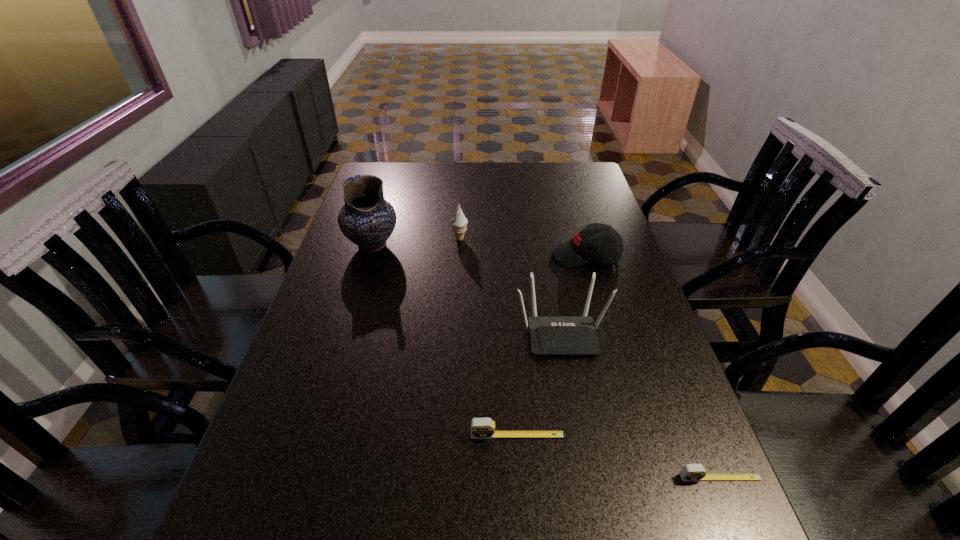
The image size is (960, 540). I want to click on the second nearest object, so click(481, 428).

At what (x,y) coordinates should I click in order to perform the action: click on the fifth tallest object. Please return your answer as a coordinate pair (x, y). This screenshot has height=540, width=960. Looking at the image, I should click on (481, 428).

Locate an element on the screen. The width and height of the screenshot is (960, 540). the right tape measure is located at coordinates (690, 472).

At what (x,y) coordinates should I click in order to perform the action: click on the shorter tape measure. Please return your answer as a coordinate pair (x, y). This screenshot has height=540, width=960. Looking at the image, I should click on (690, 472).

The height and width of the screenshot is (540, 960). I want to click on the fifth object from right to left, so tap(459, 222).

Find the location of a particular element. Image resolution: width=960 pixels, height=540 pixels. the third shortest object is located at coordinates (589, 244).

Image resolution: width=960 pixels, height=540 pixels. I want to click on the leftmost object, so click(366, 219).

Identify the location of pottery. (366, 219).

At what (x,y) coordinates should I click in order to perform the action: click on the fourth farthest object. Please return your answer as a coordinate pair (x, y). The image size is (960, 540). Looking at the image, I should click on (548, 335).

Where is `vacant space located 0.090m at the front of the taller tape measure with the tape extended`? Image resolution: width=960 pixels, height=540 pixels. vacant space located 0.090m at the front of the taller tape measure with the tape extended is located at coordinates pos(520,484).